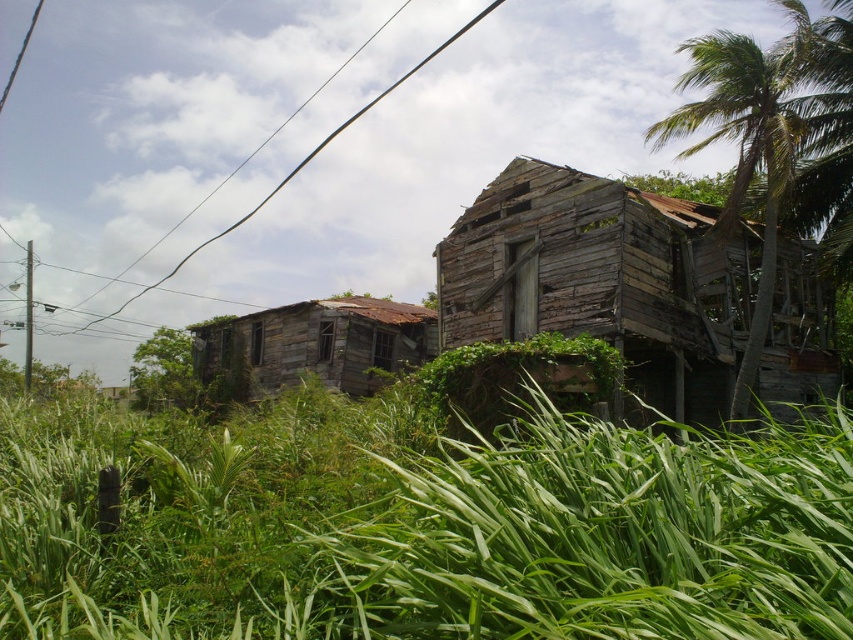
Question: Does green leafy grass at lower center come in front of weathered wood hut at center?

Choices:
 (A) no
 (B) yes

Answer: (B)

Question: Among these points, which one is farthest from the camera?

Choices:
 (A) (717, 42)
 (B) (57, 564)
 (C) (469, 230)
 (D) (206, 342)

Answer: (D)

Question: Does green leafy grass at lower center have a lesser width compared to green leafy palm tree at upper right?

Choices:
 (A) no
 (B) yes

Answer: (B)

Question: Which object appears farthest from the camera in this image?

Choices:
 (A) weathered wood hut at center
 (B) rusty wood hut at center-left
 (C) black wire at upper center

Answer: (C)

Question: Is rusty wood hut at center-left thinner than black wire at upper center?

Choices:
 (A) yes
 (B) no

Answer: (A)

Question: Estimate the real-world distances between objects in this image. Which object is farther from the green leafy palm tree at upper right?

Choices:
 (A) rusty wood hut at center-left
 (B) weathered wood hut at center
 (C) black wire at upper center
 (D) green leafy grass at lower center

Answer: (C)